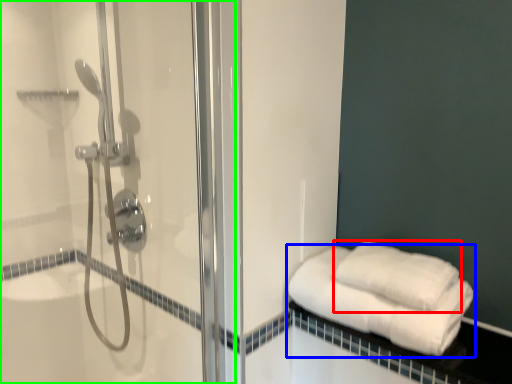
Question: Considering the real-world distances, which object is farthest from towel (highlighted by a red box)? towel (highlighted by a blue box) or shower door (highlighted by a green box)?

Choices:
 (A) towel
 (B) shower door

Answer: (B)